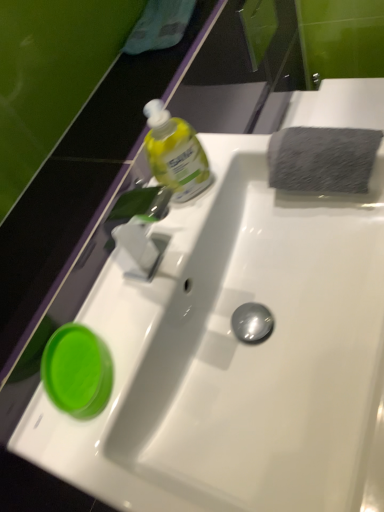
Question: From the image's perspective, is white glossy sink at center above or below green glossy cup at lower left?

Choices:
 (A) below
 (B) above

Answer: (B)

Question: Considering the positions of point (203, 309) and point (59, 380), is point (203, 309) closer or farther from the camera than point (59, 380)?

Choices:
 (A) farther
 (B) closer

Answer: (A)

Question: Which object is positioned closest to the green glossy cup at lower left?

Choices:
 (A) gray textured sponge at upper right
 (B) translucent yellow liquid at upper center
 (C) white glossy sink at center

Answer: (C)

Question: Estimate the real-world distances between objects in this image. Which object is farther from the white glossy sink at center?

Choices:
 (A) green glossy cup at lower left
 (B) gray textured sponge at upper right
 (C) translucent yellow liquid at upper center

Answer: (C)